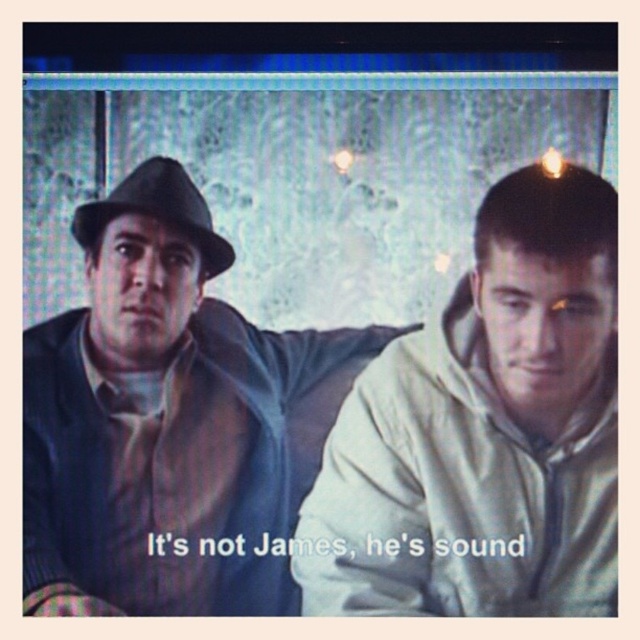
You are a photographer trying to capture a closeup of both the matte brown leather jacket at left and the matte black fedora at left. Since you want to focus on both items clearly, which one should you adjust your camera focus on first to ensure both are in sharp detail?

The matte brown leather jacket at left is closer to the viewer than the matte black fedora at left. To ensure both are in focus, adjust the camera focus starting with the matte brown leather jacket at left, then the matte black fedora at left since it is further away.

You are a costume designer preparing for a scene where two characters are sitting side by side. You need to ensure that the matte brown leather jacket at left and the white matte hoodie at right are visible to the camera. Given their height difference, which garment should be placed higher on the actors to avoid being obscured?

The matte brown leather jacket at left is much taller than the white matte hoodie at right, so to avoid obscuring either garment, the matte brown leather jacket at left should be placed higher on the actor to ensure both are visible.

You are a costume designer preparing for a scene. You need to ensure that the matte brown leather jacket at left and the matte black fedora at left are arranged correctly on the actor. According to the scene description, which item should be placed first on the actor to match the image?

The matte black fedora at left should be placed first on the actor since the matte brown leather jacket at left is located below it, meaning the jacket is worn underneath the hat.